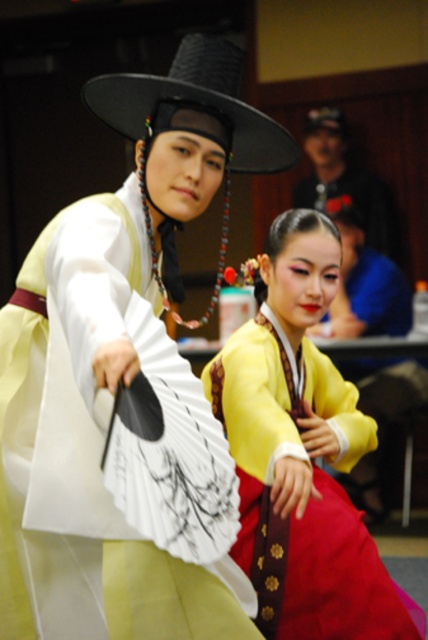
You are a photographer setting up for a traditional Korean performance. You need to ensure that the yellow satin blouse at center and the matte black hat at upper center are both visible in the frame. Based on their positions, which object should you focus on first to capture both in the shot?

The yellow satin blouse at center is positioned under the matte black hat at upper center, so focusing on the matte black hat at upper center first will ensure both objects are in the frame.

You are an event planner arranging a cultural performance. You need to place a stand for the white silk fan at center and a stand for the matte black hat at upper center on a table. The table has a width of 1 meter. If you place both items side by side, will they fit within the table width?

The white silk fan at center has a width less than the matte black hat at upper center. However, since the total width of both items combined is unknown, we cannot confirm if they will fit within the 1 meter table width. Additional information about their individual widths is needed to determine this.

You are a photographer setting up for a traditional Korean performance. You need to ensure the yellow satin blouse at center and the white silk fan at center are clearly visible in your shot. Given that your camera has a minimum focus distance of 24 inches, will both items be in focus?

The yellow satin blouse at center is 24.22 inches from the white silk fan at center. Since the minimum focus distance is 24 inches, both items will be within the focus range and should be clearly visible.